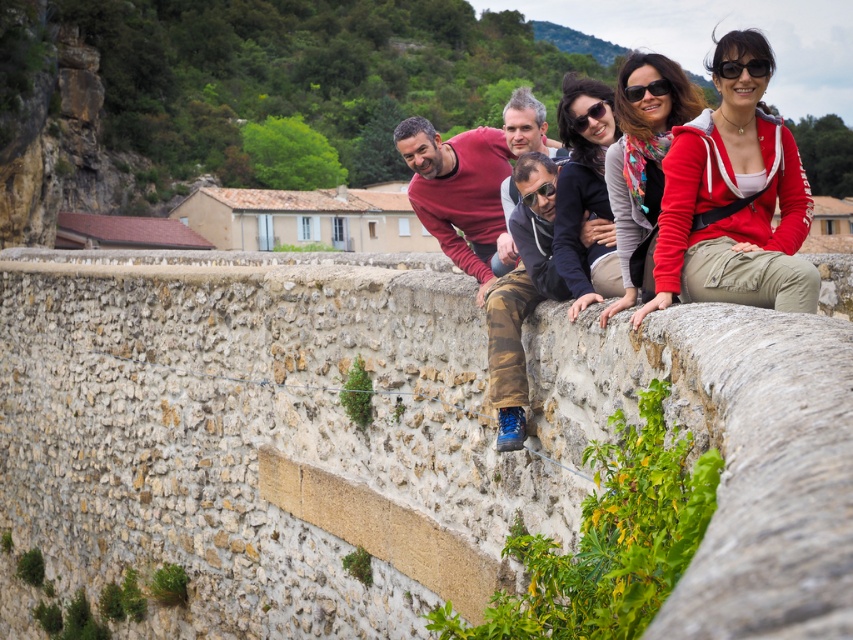
Which of these two, black plastic sunglasses at upper right or black plastic goggles at center, stands taller?

With more height is black plastic goggles at center.

Does point (718, 64) lie behind point (544, 188)?

That is False.

The width and height of the screenshot is (853, 640). What are the coordinates of `black plastic sunglasses at upper right` in the screenshot? It's located at (743, 67).

What do you see at coordinates (647, 90) in the screenshot? The height and width of the screenshot is (640, 853). I see `black plastic sunglasses at upper center` at bounding box center [647, 90].

Which is below, black plastic sunglasses at upper center or matte black sunglasses at center?

matte black sunglasses at center

At what (x,y) coordinates should I click in order to perform the action: click on black plastic sunglasses at upper center. Please return your answer as a coordinate pair (x, y). The height and width of the screenshot is (640, 853). Looking at the image, I should click on (647, 90).

Can you confirm if red hoodie at center is positioned above black plastic goggles at center?

Correct, red hoodie at center is located above black plastic goggles at center.

Describe the element at coordinates (711, 192) in the screenshot. The height and width of the screenshot is (640, 853). I see `red hoodie at center` at that location.

Is point (637, 285) more distant than point (554, 186)?

No, it is in front of (554, 186).

You are a GUI agent. You are given a task and a screenshot of the screen. Output one action in this format:
    pyautogui.click(x=<x>, y=<y>)
    Task: Click on the red hoodie at center
    This screenshot has height=640, width=853.
    Given the screenshot: What is the action you would take?
    pyautogui.click(x=711, y=192)